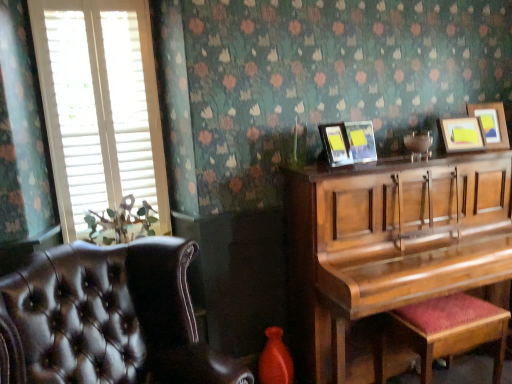
Question: Does wooden picture frame at upper right, which ranks as the 1th picture frame in left-to-right order, have a greater width compared to white wood blinds at left?

Choices:
 (A) no
 (B) yes

Answer: (B)

Question: Can you confirm if wooden picture frame at upper right, which ranks as the 1th picture frame in left-to-right order, is thinner than white wood blinds at left?

Choices:
 (A) no
 (B) yes

Answer: (A)

Question: Is wooden picture frame at upper right, which ranks as the 1th picture frame in left-to-right order, next to white wood blinds at left and touching it?

Choices:
 (A) yes
 (B) no

Answer: (B)

Question: From a real-world perspective, is wooden picture frame at upper right, which ranks as the 1th picture frame in left-to-right order, physically above white wood blinds at left?

Choices:
 (A) no
 (B) yes

Answer: (A)

Question: Considering the relative positions of wooden picture frame at upper right, which ranks as the 1th picture frame in left-to-right order, and white wood blinds at left in the image provided, is wooden picture frame at upper right, which ranks as the 1th picture frame in left-to-right order, to the left of white wood blinds at left from the viewer's perspective?

Choices:
 (A) yes
 (B) no

Answer: (B)

Question: Is wooden picture frame at upper right, which ranks as the 4th picture frame in right-to-left order, taller or shorter than wooden picture frame at upper right, placed as the 3th picture frame when sorted from left to right?

Choices:
 (A) tall
 (B) short

Answer: (A)

Question: Which is correct: wooden picture frame at upper right, which ranks as the 1th picture frame in left-to-right order, is inside wooden picture frame at upper right, placed as the 3th picture frame when sorted from left to right, or outside of it?

Choices:
 (A) outside
 (B) inside

Answer: (A)

Question: Is point (345, 137) positioned closer to the camera than point (457, 147)?

Choices:
 (A) closer
 (B) farther

Answer: (A)

Question: In terms of width, does wooden picture frame at upper right, which ranks as the 4th picture frame in right-to-left order, look wider or thinner when compared to wooden picture frame at upper right, the 2th picture frame when ordered from right to left?

Choices:
 (A) thin
 (B) wide

Answer: (B)

Question: From a real-world perspective, is wooden picture frame at upper right, acting as the 4th picture frame starting from the left, positioned above or below wooden picture frame at upper right, which ranks as the 4th picture frame in right-to-left order?

Choices:
 (A) below
 (B) above

Answer: (B)

Question: Choose the correct answer: Is wooden picture frame at upper right, acting as the 4th picture frame starting from the left, inside wooden picture frame at upper right, which ranks as the 4th picture frame in right-to-left order, or outside it?

Choices:
 (A) outside
 (B) inside

Answer: (A)

Question: Looking at their shapes, would you say wooden picture frame at upper right, arranged as the first picture frame when viewed from the right, is wider or thinner than wooden picture frame at upper right, which ranks as the 4th picture frame in right-to-left order?

Choices:
 (A) thin
 (B) wide

Answer: (A)

Question: Is wooden picture frame at upper right, acting as the 4th picture frame starting from the left, taller or shorter than wooden picture frame at upper right, which ranks as the 1th picture frame in left-to-right order?

Choices:
 (A) tall
 (B) short

Answer: (A)

Question: From a real-world perspective, relative to wooden picture frame at upper right, arranged as the first picture frame when viewed from the right, is matte black picture frame at upper center, the third picture frame viewed from the right, vertically above or below?

Choices:
 (A) above
 (B) below

Answer: (B)

Question: Is point (351, 147) positioned closer to the camera than point (498, 112)?

Choices:
 (A) closer
 (B) farther

Answer: (A)